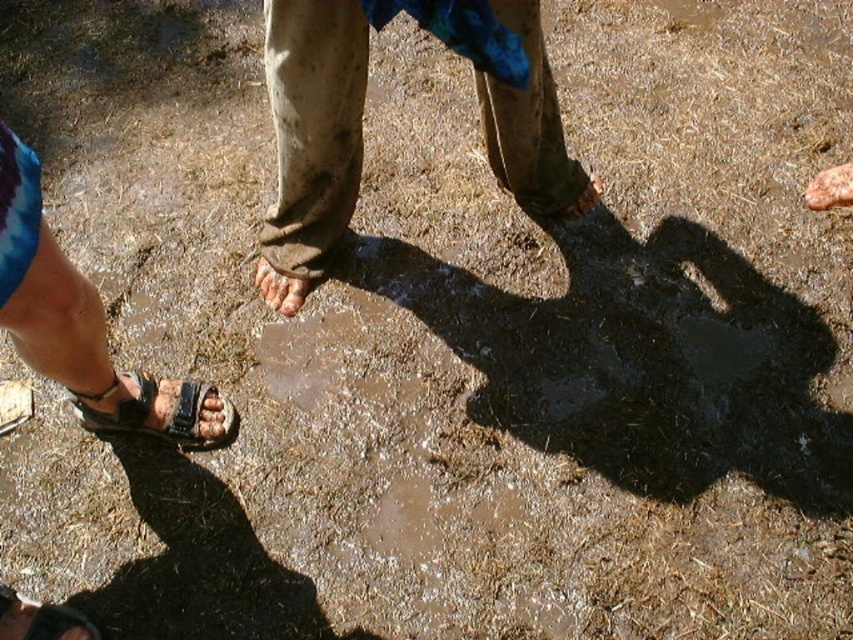
Does brown sandal at center have a greater width compared to brown matte toe at center?

Indeed, brown sandal at center has a greater width compared to brown matte toe at center.

Does point (291, 291) lie in front of point (595, 202)?

That is True.

Does point (276, 305) come closer to viewer compared to point (572, 204)?

Yes, it is in front of point (572, 204).

Identify the location of brown sandal at center. (281, 289).

Which of these two, brown leather sandals at lower left or brown leather toe at lower left, stands taller?

With more height is brown leather sandals at lower left.

Is brown leather sandals at lower left thinner than brown leather toe at lower left?

In fact, brown leather sandals at lower left might be wider than brown leather toe at lower left.

Who is more forward, (24, 193) or (210, 396)?

Point (24, 193) is in front.

Identify the location of brown leather sandals at lower left. (79, 323).

Does point (811, 195) come behind point (209, 400)?

Yes, point (811, 195) is farther from viewer.

Between pink skin at lower right and brown leather toe at lower left, which one is positioned higher?

Positioned higher is pink skin at lower right.

Between point (846, 173) and point (202, 404), which one is positioned in front?

Point (202, 404) is more forward.

Find the location of a particular element. pink skin at lower right is located at coordinates (828, 188).